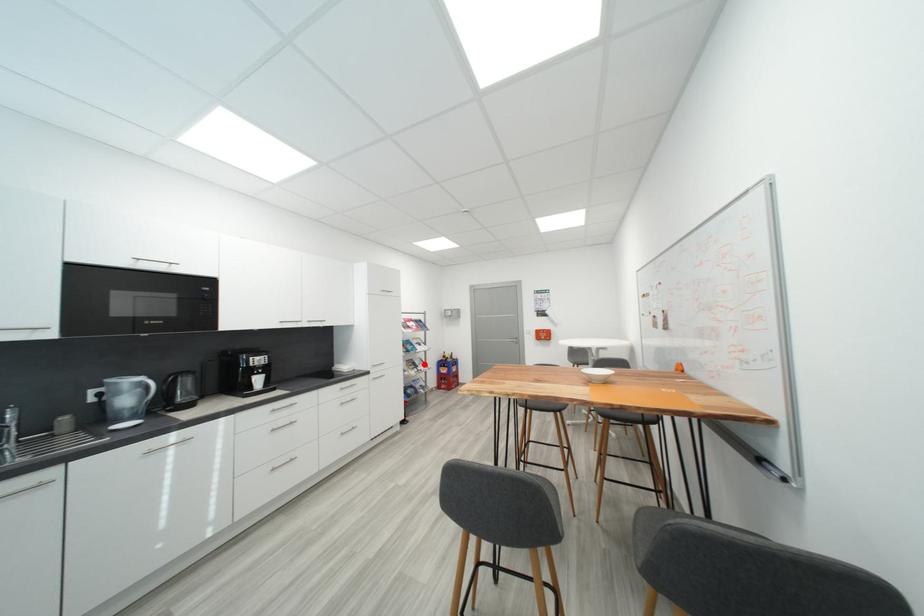
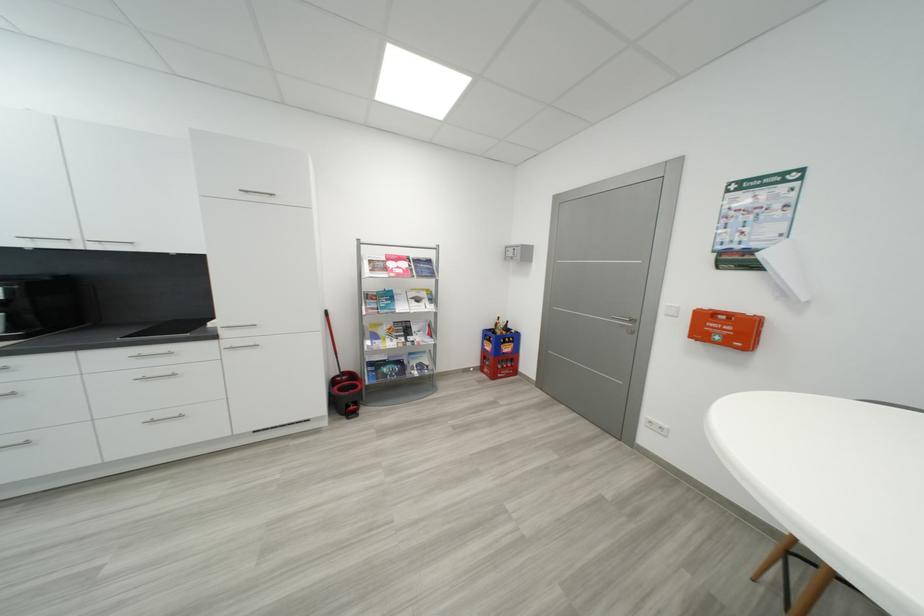
The point at the highlighted location is marked in the first image. Where is the corresponding point in the second image?

(421, 330)